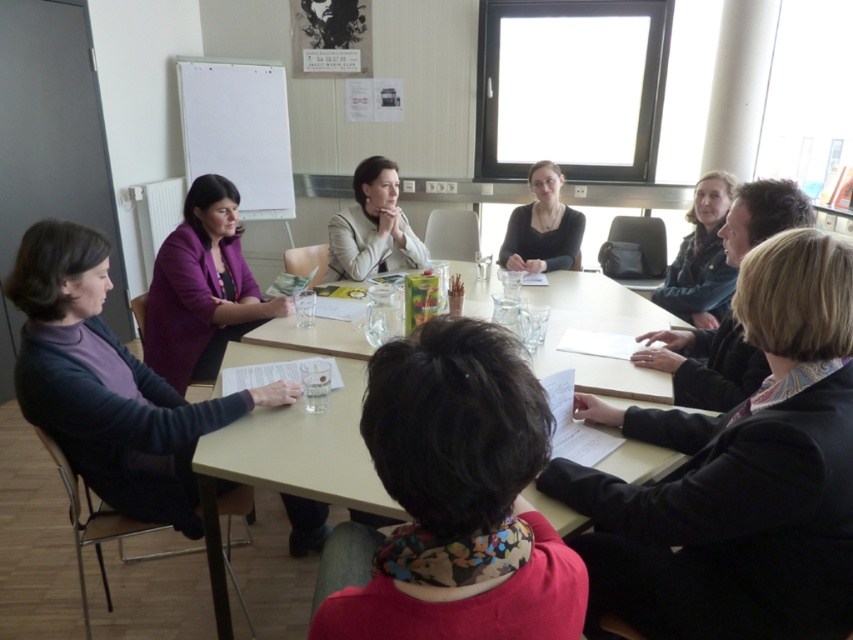
Question: Is dark brown leather jacket at upper right behind light beige leather jacket at center?

Choices:
 (A) yes
 (B) no

Answer: (B)

Question: Is dark gray sweater at lower left thinner than purple matte blazer at upper left?

Choices:
 (A) yes
 (B) no

Answer: (B)

Question: Which point appears closest to the camera in this image?

Choices:
 (A) (398, 467)
 (B) (399, 250)

Answer: (A)

Question: Does dark gray sweater at lower left appear on the right side of wooden table at center?

Choices:
 (A) no
 (B) yes

Answer: (A)

Question: Which is farther from the matte black shirt at center?

Choices:
 (A) dark brown hair at center
 (B) dark gray sweater at lower left

Answer: (A)

Question: Estimate the real-world distances between objects in this image. Which object is farther from the wooden table at center?

Choices:
 (A) dark gray sweater at lower left
 (B) black leather jacket at lower right
 (C) matte black jacket at upper right
 (D) purple matte blazer at upper left

Answer: (A)